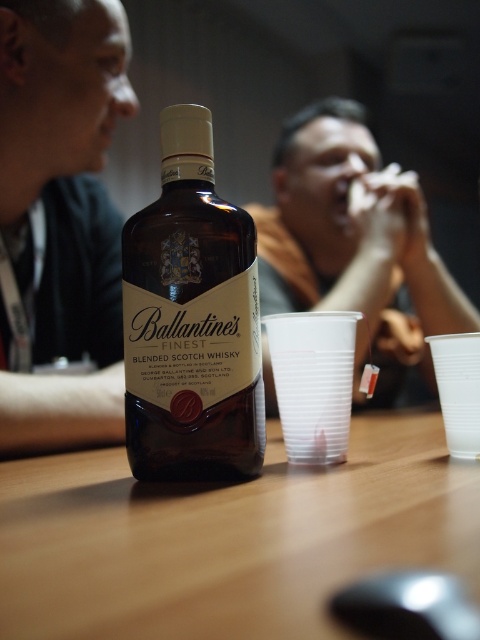
Based on the photo, you are a bartender preparing a drink. You have a brown glass bottle at center and a smooth skin face at upper left in front of you. Which object is taller?

The smooth skin face at upper left is taller than the brown glass bottle at center.

From the picture: You are at a party and want to pour the whisky from the brown glass bottle at center into the transparent plastic cup at lower right. Will the cup overflow if you fill the bottle completely into the cup?

The brown glass bottle at center is much taller than the transparent plastic cup at lower right. Since the bottle is taller, it likely holds more liquid than the cup, so pouring the entire contents of the bottle into the cup would cause it to overflow.

You are a delivery person who needs to place a package on the table shown in the image. The package is 40 centimeters long. Can you fit the package between the brown glass bottle at center and the black plastic mouse at lower center without moving either object?

The distance between the brown glass bottle at center and the black plastic mouse at lower center is 35.33 centimeters. Since the package is 40 centimeters long, it cannot fit between them as the space is smaller than the package.